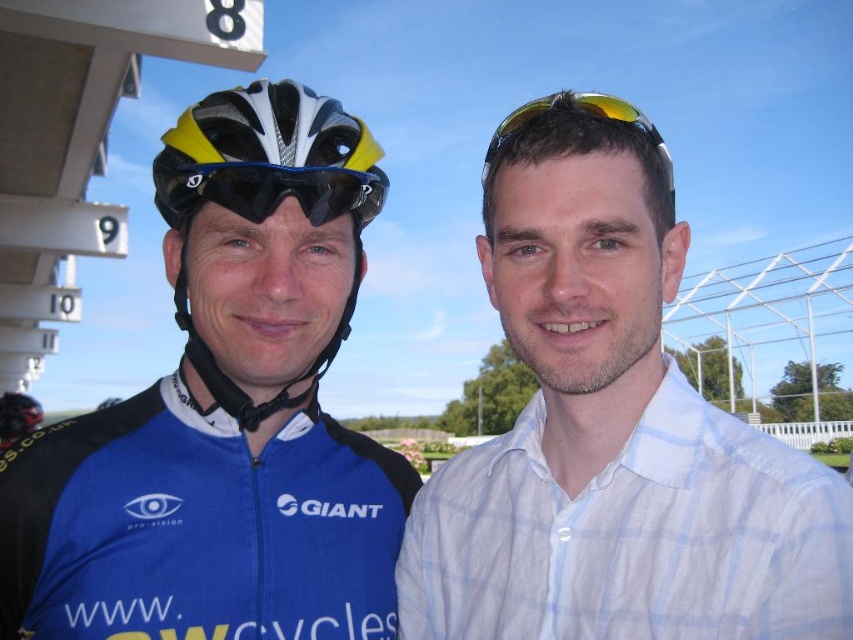
Question: Which point appears closest to the camera in this image?

Choices:
 (A) (161, 157)
 (B) (22, 417)
 (C) (535, 104)
 (D) (288, 170)

Answer: (D)

Question: Can you confirm if white checkered shirt at center is thinner than matte black helmet at left?

Choices:
 (A) yes
 (B) no

Answer: (A)

Question: Does white checkered shirt at center appear on the right side of yellow matte bicycle helmet at left?

Choices:
 (A) no
 (B) yes

Answer: (B)

Question: Which point is farther to the camera?

Choices:
 (A) matte blue jersey at left
 (B) yellow matte bicycle helmet at left

Answer: (B)

Question: Can you confirm if yellow matte bicycle helmet at left is positioned above black matte/glossy goggles at upper center?

Choices:
 (A) no
 (B) yes

Answer: (B)

Question: Which point is closer to the camera?

Choices:
 (A) (39, 528)
 (B) (194, 204)

Answer: (A)